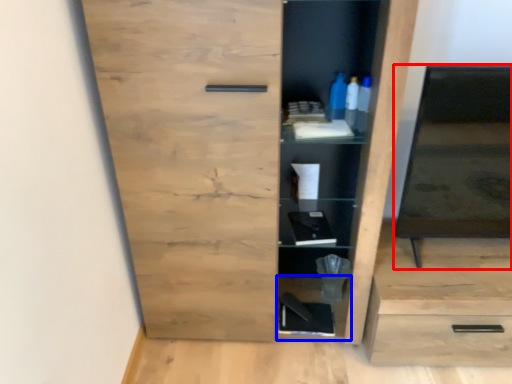
Question: Among these objects, which one is farthest to the camera, medicine cabinet (highlighted by a red box) or cabinet (highlighted by a blue box)?

Choices:
 (A) medicine cabinet
 (B) cabinet

Answer: (B)